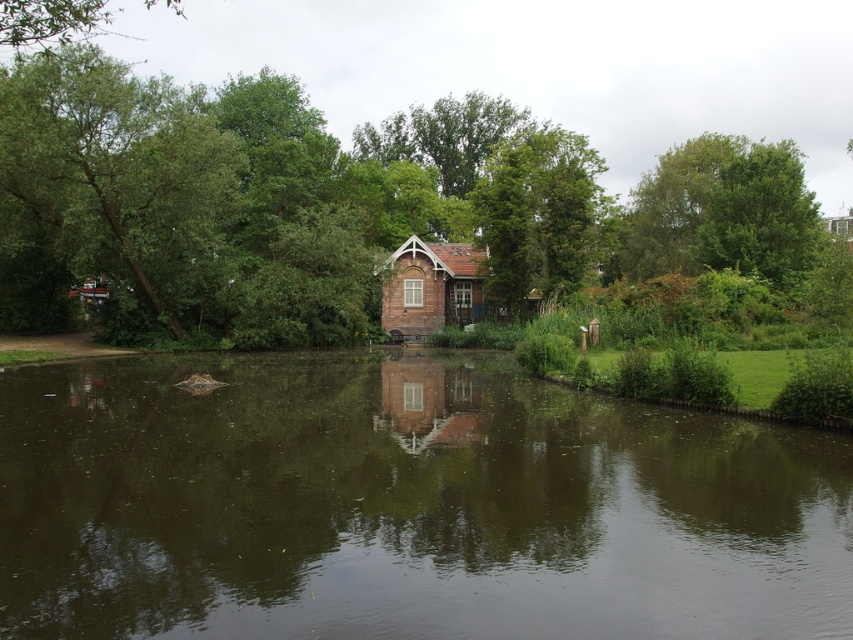
Which is below, green reflective water at center or brown brick cabin at center?

green reflective water at center is below.

Locate an element on the screen. Image resolution: width=853 pixels, height=640 pixels. green reflective water at center is located at coordinates (404, 506).

Is green reflective water at center above green leafy tree at left?

Incorrect, green reflective water at center is not positioned above green leafy tree at left.

Which is behind, point (132, 356) or point (181, 230)?

The point (181, 230) is behind.

You are a GUI agent. You are given a task and a screenshot of the screen. Output one action in this format:
    pyautogui.click(x=<x>, y=<y>)
    Task: Click on the green reflective water at center
    This screenshot has width=853, height=640.
    Given the screenshot: What is the action you would take?
    pyautogui.click(x=404, y=506)

Is point (158, 252) farther from viewer compared to point (408, 256)?

No, (158, 252) is closer to viewer.

Can you confirm if green leafy tree at left is taller than brown brick cabin at center?

Yes.

The height and width of the screenshot is (640, 853). What do you see at coordinates (111, 195) in the screenshot? I see `green leafy tree at left` at bounding box center [111, 195].

Locate an element on the screen. This screenshot has width=853, height=640. green leafy tree at left is located at coordinates (111, 195).